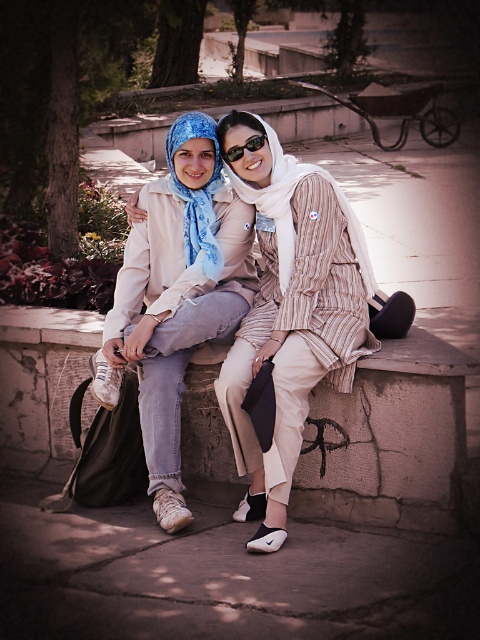
Question: Which of the following is the closest to the observer?

Choices:
 (A) matte beige scarf at center
 (B) white textured scarf at center
 (C) sunglasses at center
 (D) blue silk scarf at center

Answer: (A)

Question: In this image, where is white textured scarf at center located relative to sunglasses at center?

Choices:
 (A) left
 (B) right

Answer: (B)

Question: Which of the following is the closest to the observer?

Choices:
 (A) (263, 451)
 (B) (339, 198)
 (C) (239, 156)
 (D) (205, 248)

Answer: (A)

Question: Is white textured scarf at center positioned before blue silk scarf at center?

Choices:
 (A) yes
 (B) no

Answer: (A)

Question: Which of these objects is positioned farthest from the matte beige scarf at center?

Choices:
 (A) white textured scarf at center
 (B) sunglasses at center
 (C) blue silk scarf at center

Answer: (B)

Question: Does matte beige scarf at center have a smaller size compared to white textured scarf at center?

Choices:
 (A) yes
 (B) no

Answer: (B)